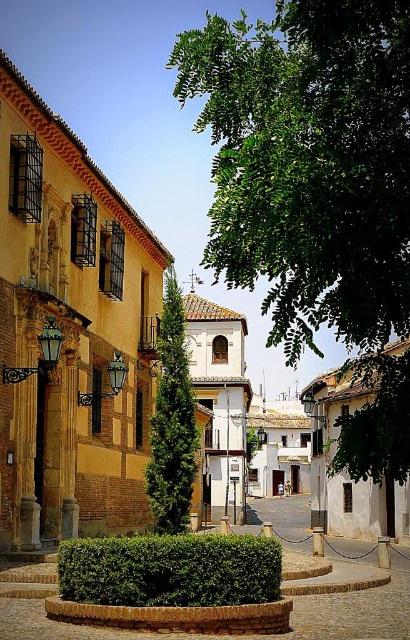
In the scene shown: You are standing at the starting point of the cobblestone street in the historic Spanish town. You see two points marked on the ground ahead of you. The first point is at coordinate point(214, 113) and the second point is at coordinate point(273, 600). Which point is closer to you as you stand at the starting point?

Point(214, 113) is closer to you because it is further to the camera than point(273, 600), meaning it is nearer to your current position at the starting point.